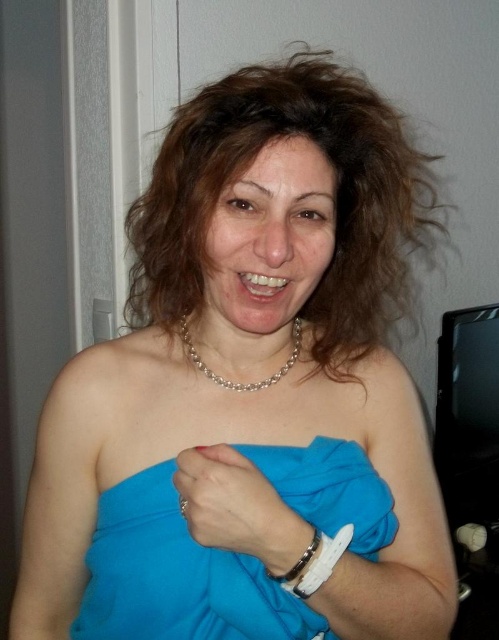
Question: Is white matte ring at center to the left of pearl necklace at center from the viewer's perspective?

Choices:
 (A) yes
 (B) no

Answer: (B)

Question: Does blue satin dress at center have a greater width compared to pearl necklace at center?

Choices:
 (A) no
 (B) yes

Answer: (B)

Question: Can you confirm if brown curly hair at upper center is positioned to the right of blue satin dress at center?

Choices:
 (A) no
 (B) yes

Answer: (B)

Question: Estimate the real-world distances between objects in this image. Which object is farther from the white matte ring at center?

Choices:
 (A) brown curly hair at upper center
 (B) white leather bracelet at lower center
 (C) pearl necklace at center

Answer: (A)

Question: Which point is farther from the camera taking this photo?

Choices:
 (A) (297, 556)
 (B) (340, 554)

Answer: (B)

Question: Which point is closer to the camera taking this photo?

Choices:
 (A) (333, 564)
 (B) (183, 317)
 (C) (317, 145)

Answer: (A)